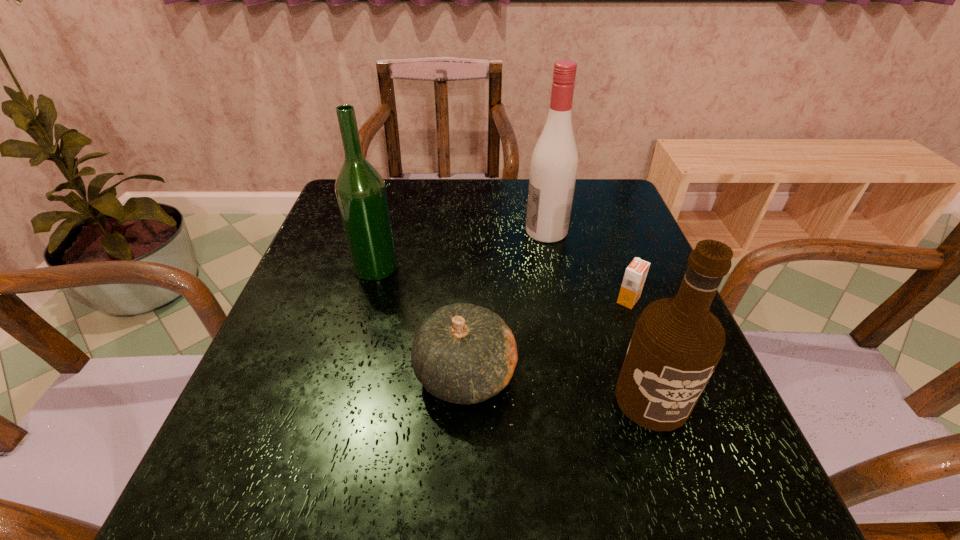
Where is `free spot between the orange juice and the fourth nearest object`? free spot between the orange juice and the fourth nearest object is located at coordinates (502, 284).

Locate an element on the screen. This screenshot has width=960, height=540. vacant area that lies between the second farthest alcohol and the third farthest object is located at coordinates (502, 284).

Identify the location of vacant space that's between the shortest object and the farthest alcohol. (588, 266).

Image resolution: width=960 pixels, height=540 pixels. What are the coordinates of `free space between the fourth tallest object and the second farthest object` in the screenshot? It's located at (420, 320).

This screenshot has height=540, width=960. I want to click on free space between the gourd and the farthest alcohol, so click(x=506, y=302).

Locate an element on the screen. the fourth closest object to the leftmost object is located at coordinates (677, 342).

Point out which object is positioned as the third nearest to the leftmost alcohol. Please provide its 2D coordinates. Your answer should be formatted as a tuple, i.e. [(x, y)], where the tuple contains the x and y coordinates of a point satisfying the conditions above.

[(635, 275)]

Select which alcohol appears as the second closest to the fourth tallest object. Please provide its 2D coordinates. Your answer should be formatted as a tuple, i.e. [(x, y)], where the tuple contains the x and y coordinates of a point satisfying the conditions above.

[(360, 190)]

The height and width of the screenshot is (540, 960). Find the location of `the closest alcohol relative to the second alcohol from left to right`. the closest alcohol relative to the second alcohol from left to right is located at coordinates (360, 190).

I want to click on free region that satisfies the following two spatial constraints: 1. on the front side of the gourd; 2. on the left side of the leftmost object, so click(346, 374).